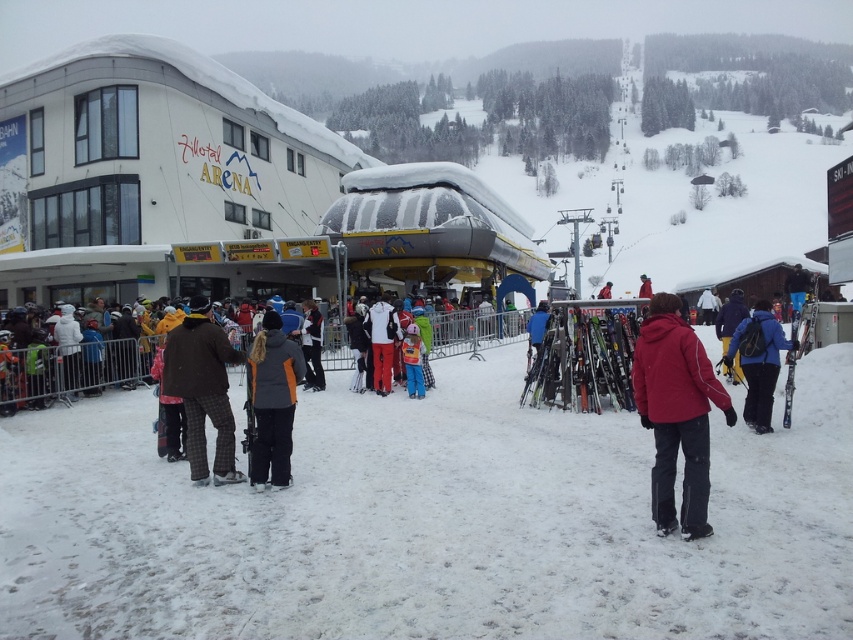
Is point (788, 358) closer to viewer compared to point (250, 396)?

No.

Is metallic skis at right in front of matte black ski at center?

No.

Who is more forward, (788, 275) or (247, 372)?

Point (247, 372)

Image resolution: width=853 pixels, height=640 pixels. In order to click on metallic skis at right in this screenshot , I will do `click(798, 294)`.

Is orange snow pants at center below matte black ski at center?

No, orange snow pants at center is not below matte black ski at center.

Is point (407, 371) behind point (251, 436)?

Yes, point (407, 371) is behind point (251, 436).

Find the location of `orange snow pants at center`. orange snow pants at center is located at coordinates (413, 360).

Locate an element on the screen. white matte jacket at center is located at coordinates (381, 340).

Who is more distant from viewer, (396, 324) or (408, 330)?

Positioned behind is point (396, 324).

Is point (386, 364) farther from viewer compared to point (410, 371)?

Yes.

Locate an element on the screen. The width and height of the screenshot is (853, 640). white matte jacket at center is located at coordinates (381, 340).